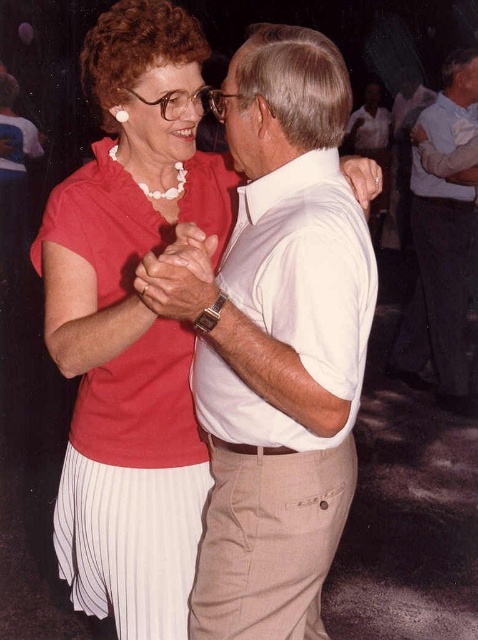
Who is positioned more to the right, matte white blouse at center or matte red dress at center?

matte white blouse at center

You are a GUI agent. You are given a task and a screenshot of the screen. Output one action in this format:
    pyautogui.click(x=<x>, y=<y>)
    Task: Click on the matte white blouse at center
    This screenshot has height=640, width=478.
    Given the screenshot: What is the action you would take?
    pos(131,323)

At what (x,y) coordinates should I click in order to perform the action: click on matte white blouse at center. Please return your answer as a coordinate pair (x, y). Looking at the image, I should click on (131, 323).

Is matte white blouse at center positioned at the back of white cotton shirt at upper center?

No, it is not.

Which is in front, point (61, 566) or point (411, 356)?

Point (61, 566) is more forward.

Is point (212, 216) farther from viewer compared to point (465, 99)?

That is False.

In order to click on matte white blouse at center in this screenshot , I will do `click(131, 323)`.

Can you confirm if matte red dress at center is thinner than white cotton shirt at upper center?

Correct, matte red dress at center's width is less than white cotton shirt at upper center's.

This screenshot has width=478, height=640. What do you see at coordinates (133, 486) in the screenshot?
I see `matte red dress at center` at bounding box center [133, 486].

What are the coordinates of `matte red dress at center` in the screenshot? It's located at (133, 486).

Image resolution: width=478 pixels, height=640 pixels. I want to click on matte red dress at center, so click(133, 486).